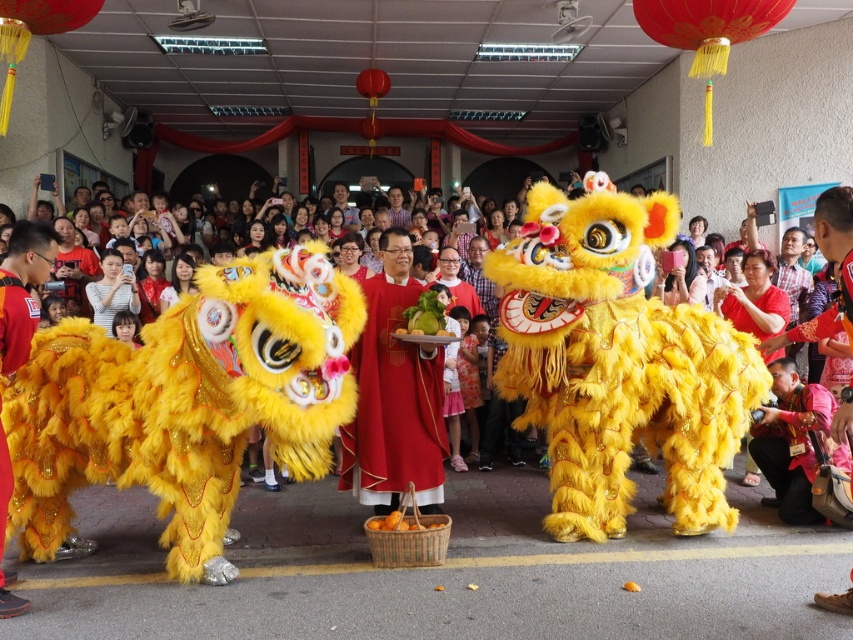
Question: Which of the following is the farthest from the observer?

Choices:
 (A) (431, 436)
 (B) (26, 348)

Answer: (A)

Question: Can you confirm if silky red robe at center is positioned to the right of velvet yellow lion costume at center?

Choices:
 (A) yes
 (B) no

Answer: (A)

Question: In this image, where is silky red robe at center located relative to velvet yellow lion costume at center?

Choices:
 (A) above
 (B) below

Answer: (A)

Question: Among these objects, which one is farthest from the camera?

Choices:
 (A) velvet yellow lion costume at center
 (B) silky red robe at center

Answer: (B)

Question: From the image, what is the correct spatial relationship of silky red robe at center in relation to velvet yellow lion costume at center?

Choices:
 (A) below
 (B) above

Answer: (B)

Question: Among these points, which one is farthest from the camera?

Choices:
 (A) (393, 316)
 (B) (26, 312)

Answer: (A)